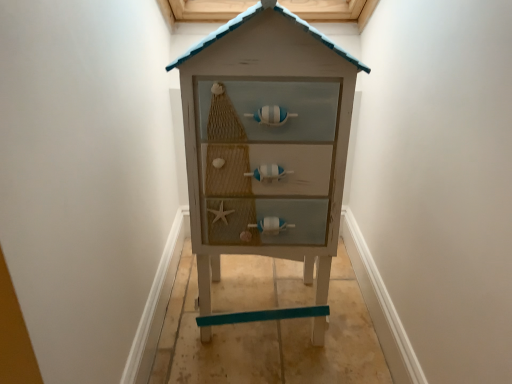
Describe the element at coordinates (266, 150) in the screenshot. I see `white wood chest of drawers at center` at that location.

Find the location of a particular element. This screenshot has width=512, height=384. white wood chest of drawers at center is located at coordinates (266, 150).

Find the location of a particular element. The height and width of the screenshot is (384, 512). white wood chest of drawers at center is located at coordinates (266, 150).